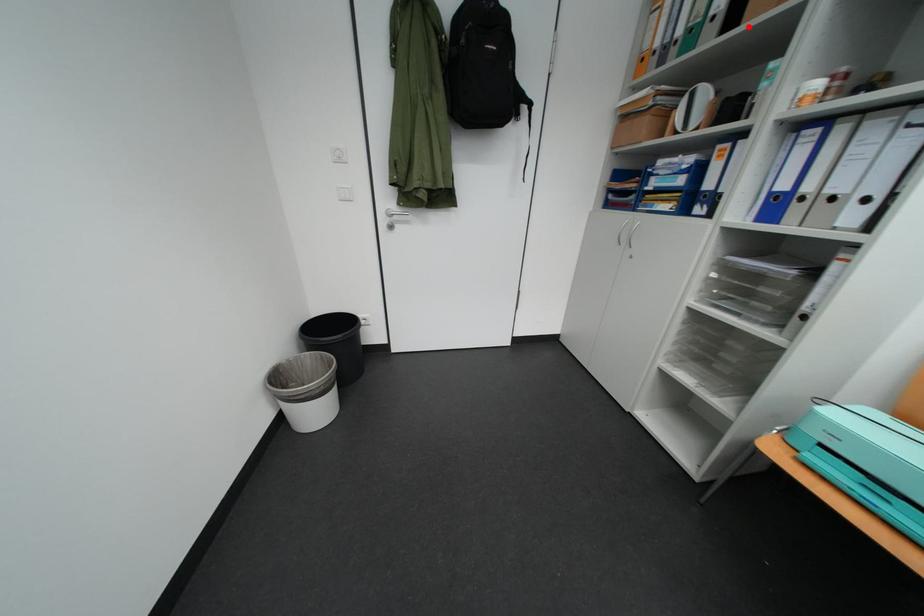
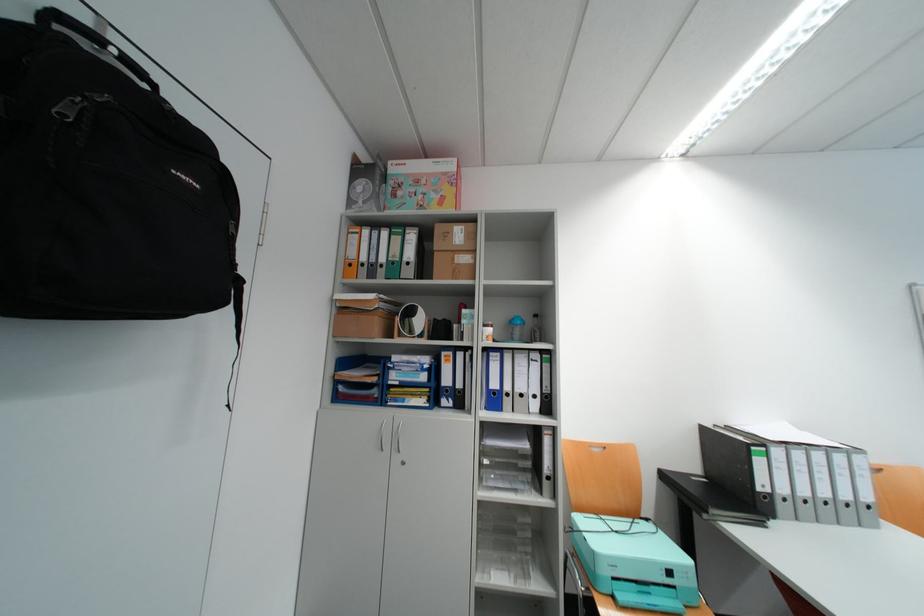
Locate, in the second image, the point that corresponds to the highlighted location in the first image.

(444, 280)